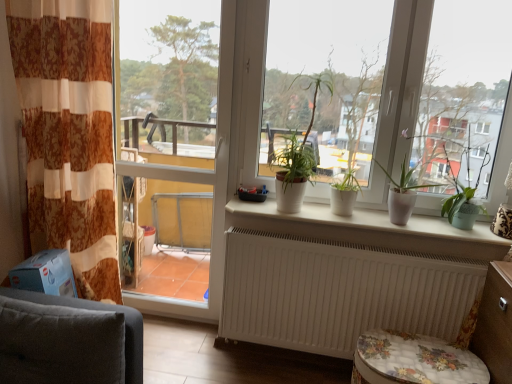
At what (x,y) coordinates should I click in order to perform the action: click on empty space that is in between white matte pot at center, which is the 2th houseplant from left to right, and white matte plant pot at center, marked as the third houseplant in a right-to-left arrangement. Please return your answer as a coordinate pair (x, y). The height and width of the screenshot is (384, 512). Looking at the image, I should click on (333, 218).